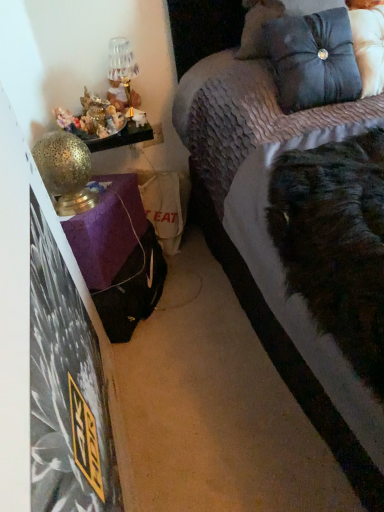
Question: From the image's perspective, is gold textured table lamp at left, arranged as the 2th table lamp when viewed from the top, located above or below satin blue pillow at upper right?

Choices:
 (A) above
 (B) below

Answer: (B)

Question: Is gold textured table lamp at left, arranged as the 2th table lamp when viewed from the top, to the left or to the right of satin blue pillow at upper right in the image?

Choices:
 (A) left
 (B) right

Answer: (A)

Question: Estimate the real-world distances between objects in this image. Which object is farther from the satin blue pillow at upper right?

Choices:
 (A) velvet purple bed at upper right
 (B) shiny metallic figurines at left
 (C) metallic gold table lamp at upper left, arranged as the second table lamp when viewed from the front
 (D) gold textured table lamp at left, which appears as the 1th table lamp when viewed from the front

Answer: (D)

Question: Based on their relative distances, which object is nearer to the shiny metallic figurines at left?

Choices:
 (A) velvet purple bed at upper right
 (B) satin blue pillow at upper right
 (C) gold textured table lamp at left, which is counted as the first table lamp, starting from the bottom
 (D) metallic gold table lamp at upper left, which is the 2th table lamp from bottom to top

Answer: (D)